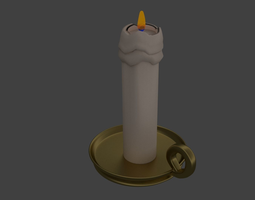
Find any where i'd pickup candle holder in the image. Your answer should be formatted as a list of tuples, i.e. [(x1, y1), (x2, y2), ...], where each tuple contains the x and y coordinates of a point satisfying the conditions above.

[(190, 154)]